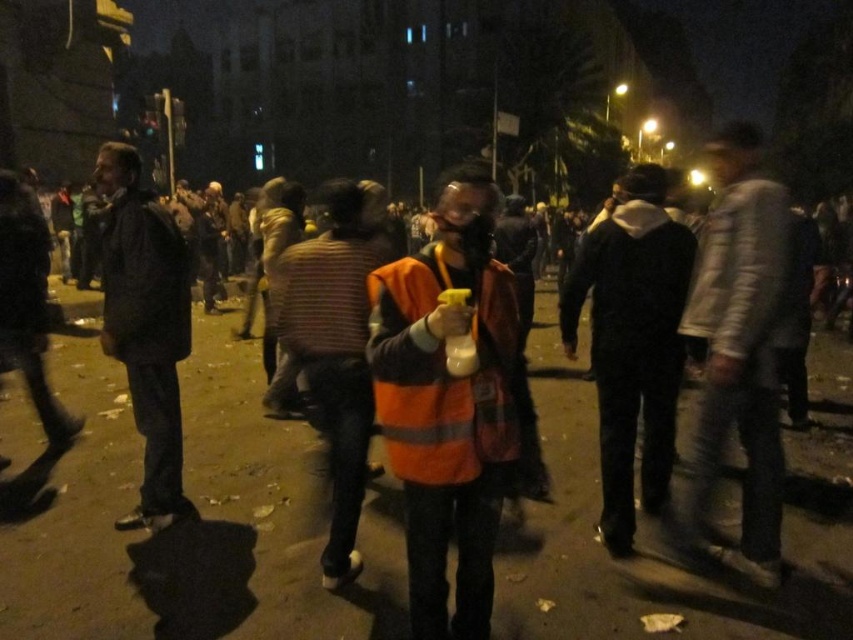
You are a pedestrian trying to cross the street at night. You see the black matte jacket at center and the orange reflective safety vest at center. Which one is more visible to drivers in the dark?

The orange reflective safety vest at center is more visible to drivers in the dark because reflective materials are designed to reflect light, making them highly visible even in low light conditions.

You are a delivery person who needs to place a package between the black matte jacket at center and the orange reflective safety vest at center. The package is 1.5 meters long. Can you fit it between them without moving either object?

The distance between the black matte jacket at center and the orange reflective safety vest at center is 1.30 meters. Since the package is 1.5 meters long, it cannot fit between them without moving either object.